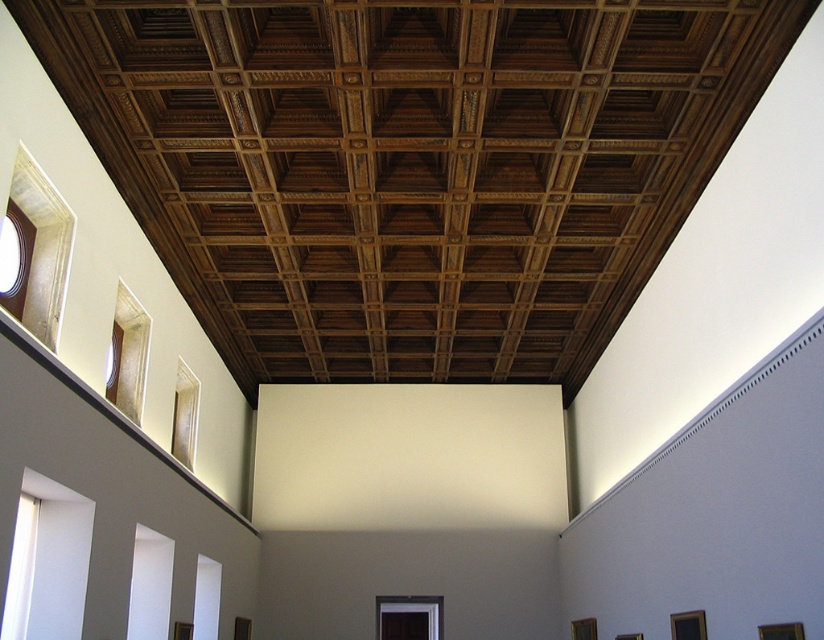
You are standing in the room and want to locate the point at coordinates (206,598). According to the scene description, where would this point be located?

The point at coordinates (206,598) is located on the white matte window at lower center.

Based on the photo, you are standing in the room and want to look out through the windows. Which window, the white glass window at lower left or the transparent glass window at lower right, is higher up?

The white glass window at lower left is located above the transparent glass window at lower right, so the white glass window at lower left is higher up.

You are standing in the room and want to look outside through the white glass window at lower left and the matte glass window at center. Which window is located to the left of the other?

The white glass window at lower left is positioned on the left side of matte glass window at center.